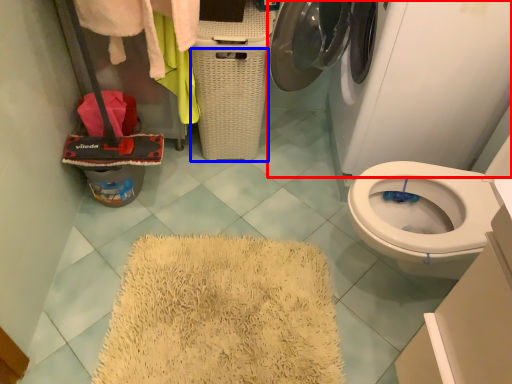
Question: Which of the following is the farthest to the observer, washing machine (highlighted by a red box) or basket (highlighted by a blue box)?

Choices:
 (A) washing machine
 (B) basket

Answer: (B)